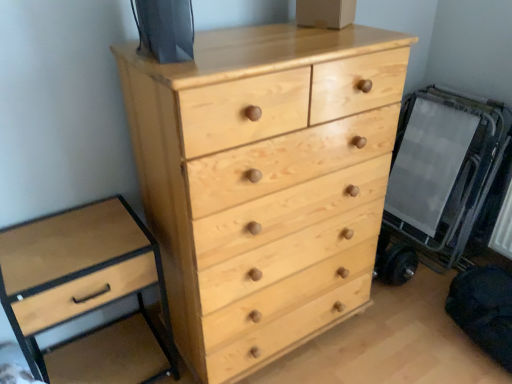
Where is `free point above light wood/texture drawer at left, the 2th chest of drawers from the right (from a real-world perspective)`? free point above light wood/texture drawer at left, the 2th chest of drawers from the right (from a real-world perspective) is located at coordinates (74, 242).